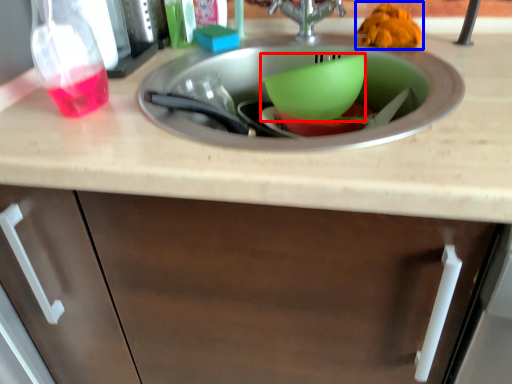
Question: Among these objects, which one is farthest to the camera, basin (highlighted by a red box) or food (highlighted by a blue box)?

Choices:
 (A) basin
 (B) food

Answer: (B)